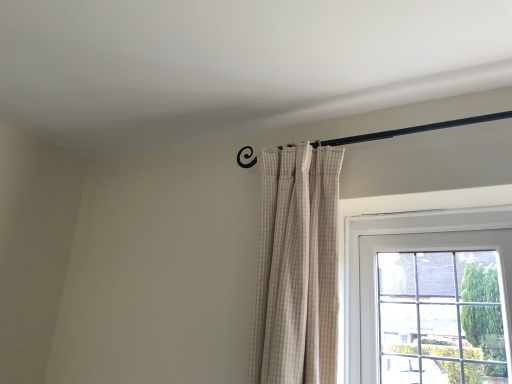
Identify the location of beige checkered curtain at upper center. (297, 268).

What do you see at coordinates (297, 268) in the screenshot? Image resolution: width=512 pixels, height=384 pixels. I see `beige checkered curtain at upper center` at bounding box center [297, 268].

You are a GUI agent. You are given a task and a screenshot of the screen. Output one action in this format:
    pyautogui.click(x=<x>, y=<y>)
    Task: Click on the beige checkered curtain at upper center
    This screenshot has width=512, height=384.
    Given the screenshot: What is the action you would take?
    pyautogui.click(x=297, y=268)